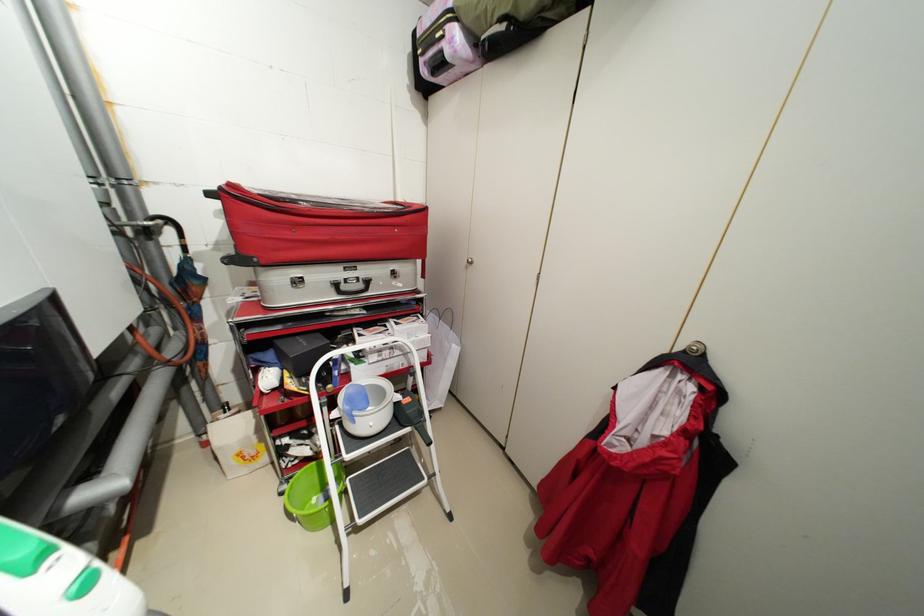
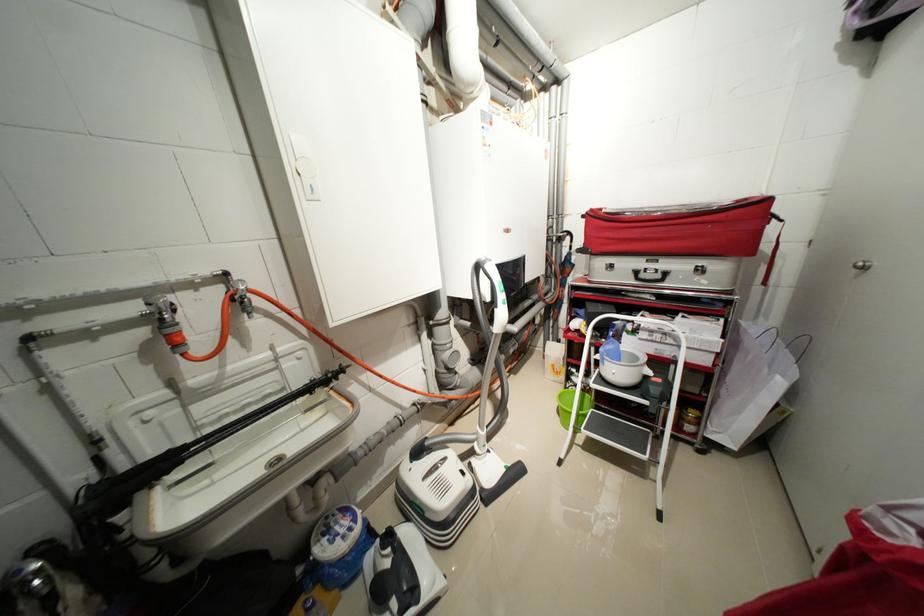
Find the pixel in the second image that matches [296,498] in the first image.

(566, 397)